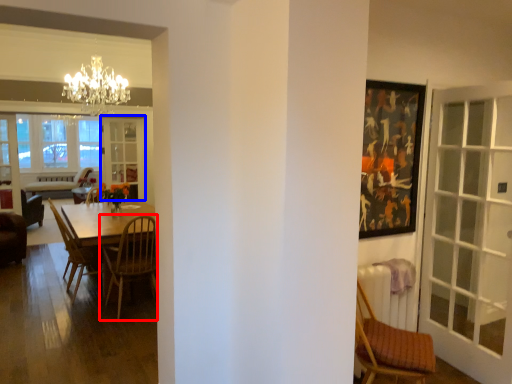
Question: Among these objects, which one is nearest to the camera, chair (highlighted by a red box) or screen door (highlighted by a blue box)?

Choices:
 (A) chair
 (B) screen door

Answer: (A)